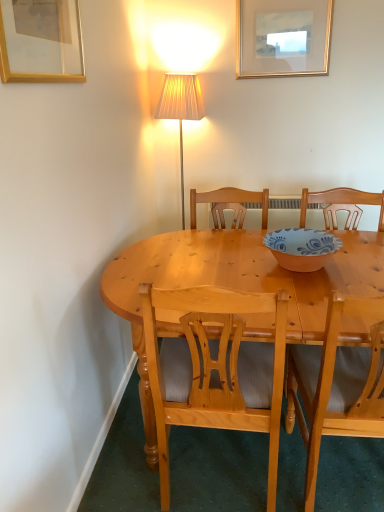
Identify the location of vacant region below gold/glass picture frame at upper left, marked as the second picture frame in a right-to-left arrangement (from a real-world perspective). The image size is (384, 512). (113, 431).